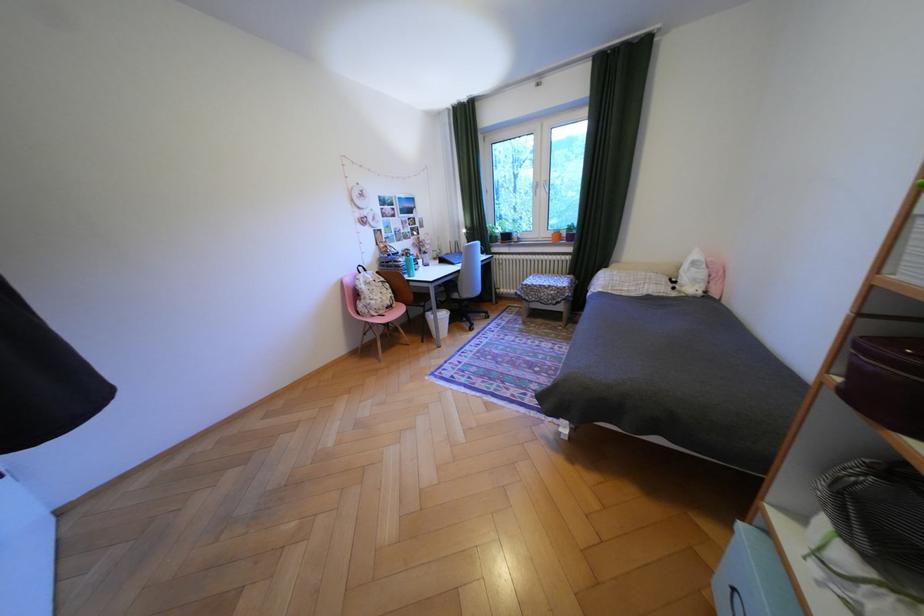
What do you see at coordinates (878, 514) in the screenshot? Image resolution: width=924 pixels, height=616 pixels. I see `the backpack handle` at bounding box center [878, 514].